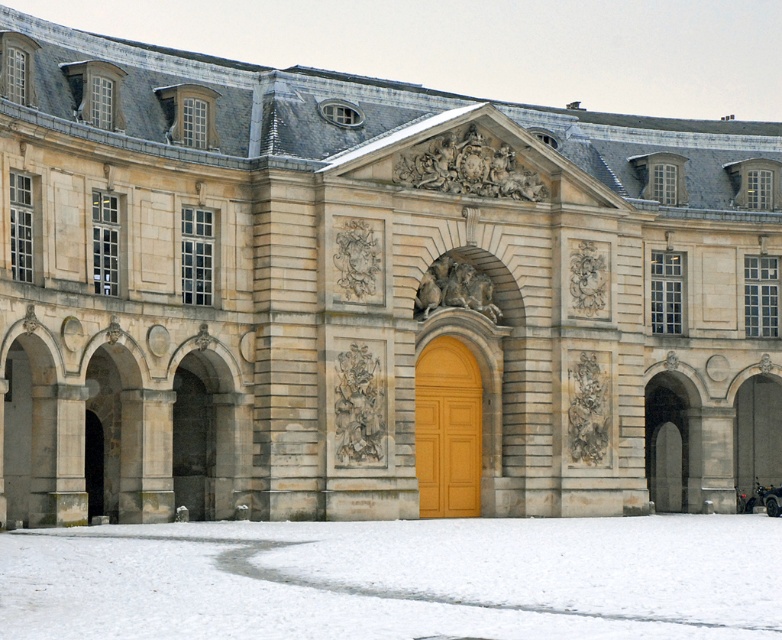
You are a delivery person who needs to deliver a package to the matte wood door at center. However, there is white powdery snow at lower center in the way. Can you walk directly to the door without stepping on the snow?

The white powdery snow at lower center is larger in size than the matte wood door at center, so it might cover the path leading to the door. Therefore, you may need to walk around the snow to reach the door without stepping on it.

You are standing in front of a grand historical building with a golden door. There is white powdery snow at lower center. Where is the white powdery snow located in relation to the golden door?

The white powdery snow at lower center is located at coordinates point (397,579), which is to the right and slightly below the golden door.